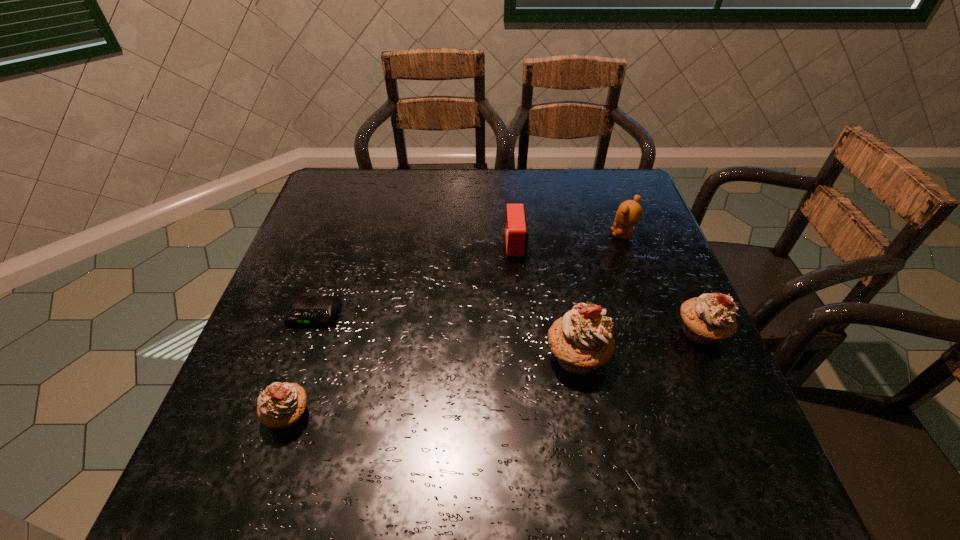
At what (x,y) coordinates should I click in order to perform the action: click on the shorter alarm clock. Please return your answer as a coordinate pair (x, y). Looking at the image, I should click on (303, 310).

Image resolution: width=960 pixels, height=540 pixels. Identify the location of vacant area situated on the back of the nearest object. (307, 358).

This screenshot has width=960, height=540. In order to click on free space located 0.060m on the right of the second cupcake from left to right in this screenshot , I will do `click(638, 356)`.

The height and width of the screenshot is (540, 960). I want to click on vacant region located 0.070m on the left of the second tallest cupcake, so click(642, 332).

Find the location of a particular element. The image size is (960, 540). free space located 0.360m on the front-facing side of the taller alarm clock is located at coordinates (367, 244).

At what (x,y) coordinates should I click in order to perform the action: click on free region located on the front-facing side of the taller alarm clock. Please return your answer as a coordinate pair (x, y). Looking at the image, I should click on click(x=405, y=244).

Where is `vacant space located on the front-facing side of the taller alarm clock`? Image resolution: width=960 pixels, height=540 pixels. vacant space located on the front-facing side of the taller alarm clock is located at coordinates (432, 244).

This screenshot has width=960, height=540. I want to click on vacant space situated on the face of the teddy bear, so click(535, 235).

Where is `free spot located 0.250m on the face of the teddy bear`? The image size is (960, 540). free spot located 0.250m on the face of the teddy bear is located at coordinates (516, 235).

Find the location of `free space located on the face of the teddy bear`. free space located on the face of the teddy bear is located at coordinates (493, 235).